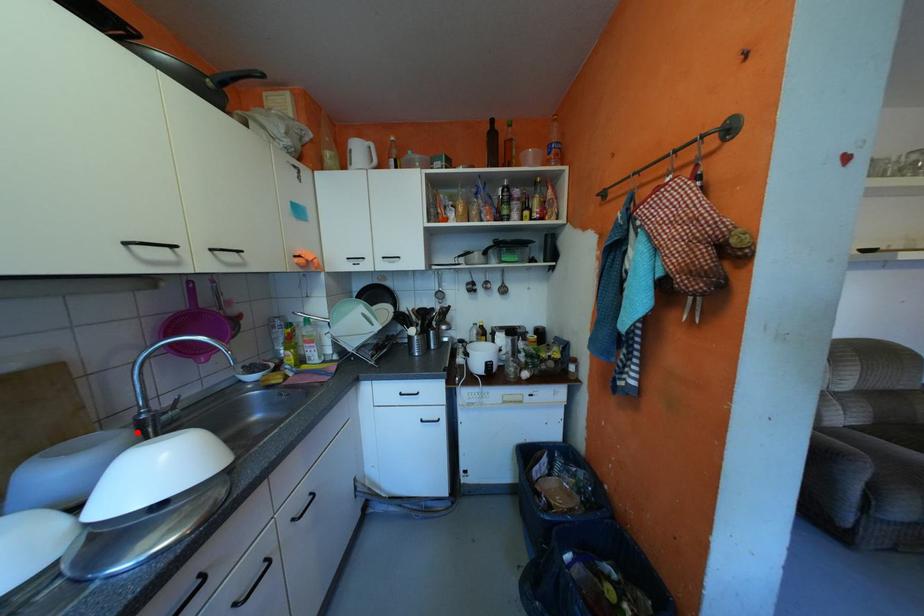
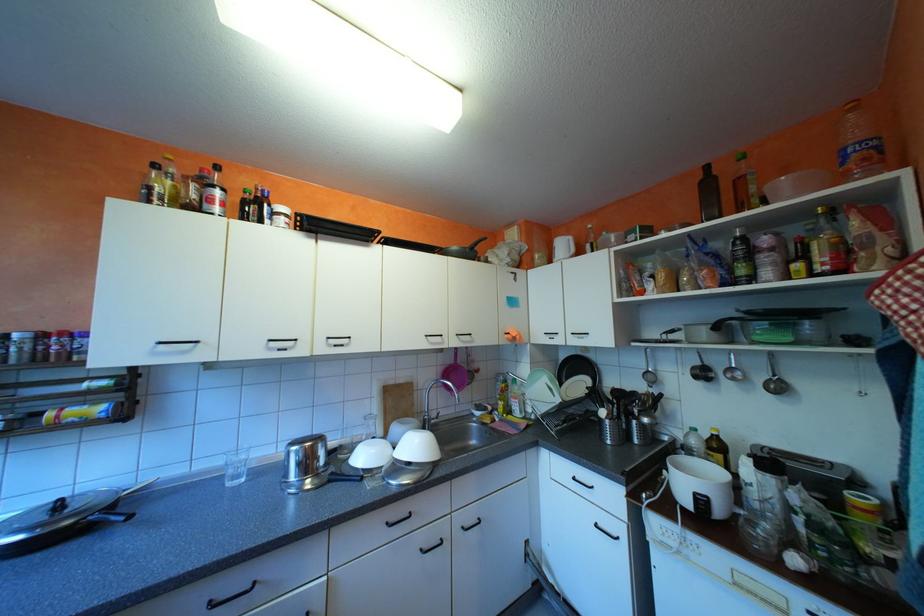
In the second image, find the point that corresponds to the highlighted location in the first image.

(428, 422)